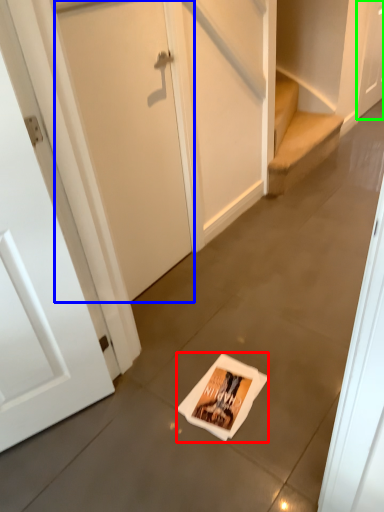
Question: Which object is positioned closest to flyer (highlighted by a red box)? Select from door (highlighted by a blue box) and door (highlighted by a green box).

Choices:
 (A) door
 (B) door

Answer: (A)